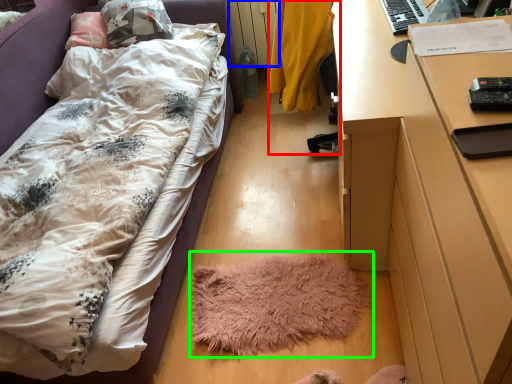
Question: Which object is the farthest from chair (highlighted by a red box)? Choose among these: radiator (highlighted by a blue box) or mat (highlighted by a green box).

Choices:
 (A) radiator
 (B) mat

Answer: (A)